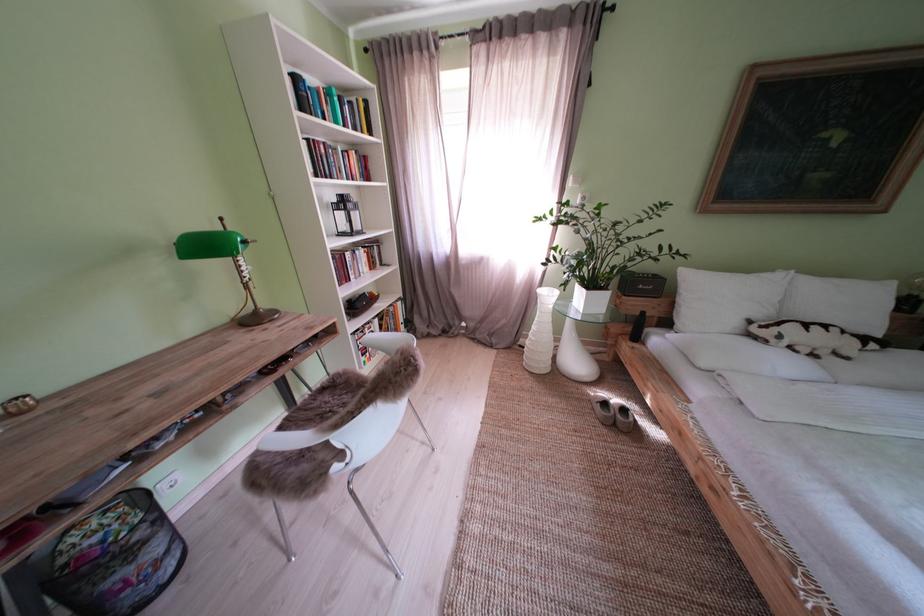
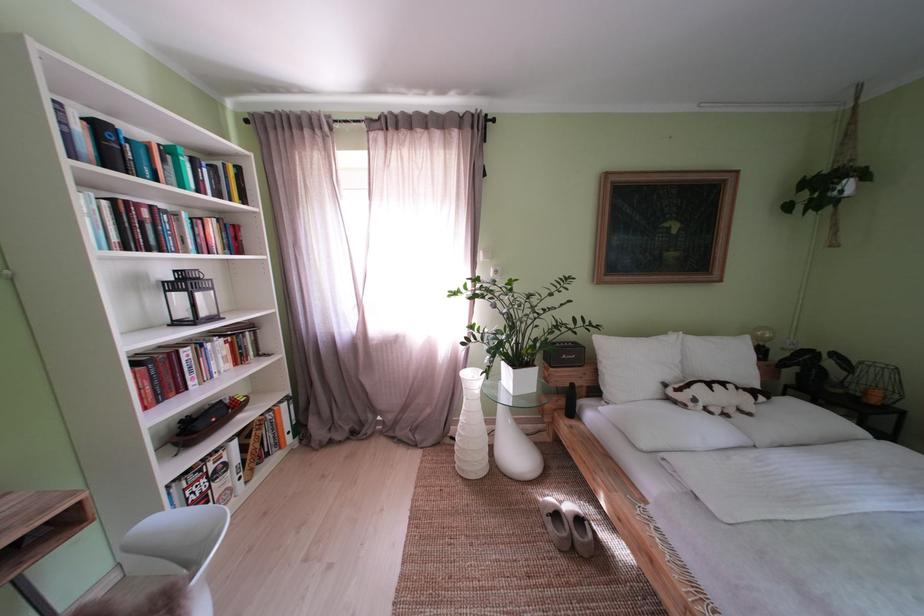
Where in the second image is the point corresponding to (x=359, y=261) from the first image?

(199, 359)